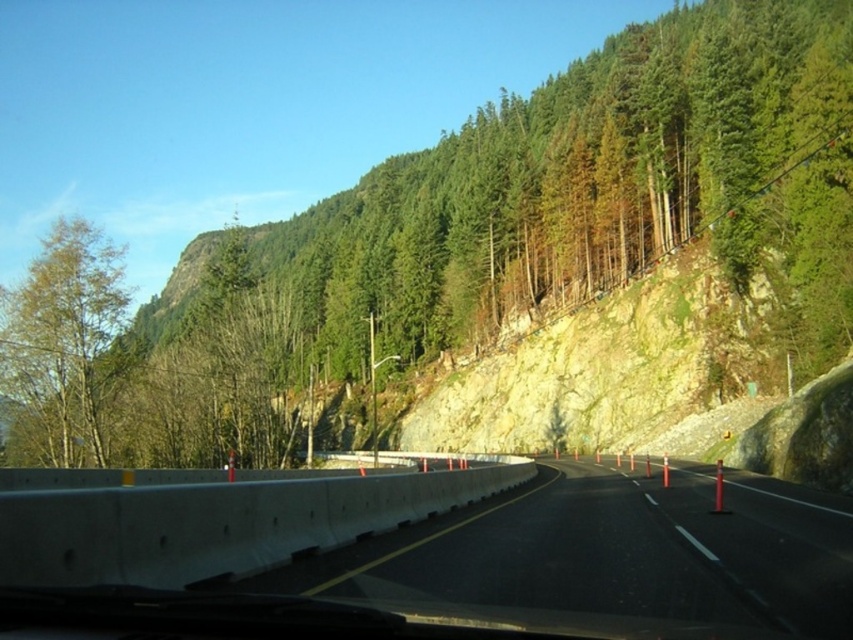
Is point (634, 56) in front of point (666, 595)?

No, (634, 56) is further to viewer.

Which is in front, point (634, 168) or point (646, 605)?

Point (646, 605)

This screenshot has width=853, height=640. Find the location of `green textured tree at upper center`. green textured tree at upper center is located at coordinates (515, 227).

What do you see at coordinates (613, 552) in the screenshot? I see `concrete barrier at center` at bounding box center [613, 552].

Who is taller, concrete barrier at center or green matte tree at left?

green matte tree at left is taller.

Image resolution: width=853 pixels, height=640 pixels. What are the coordinates of `concrete barrier at center` in the screenshot? It's located at (613, 552).

Identify the location of concrete barrier at center. The image size is (853, 640). (613, 552).

Between point (527, 148) and point (73, 460), which one is positioned in front?

Point (73, 460)

Does green textured tree at upper center have a greater height compared to green matte tree at left?

Yes, green textured tree at upper center is taller than green matte tree at left.

Based on the photo, who is more forward, (844,131) or (90,237)?

Point (844,131)

Image resolution: width=853 pixels, height=640 pixels. Identify the location of green textured tree at upper center. (515, 227).